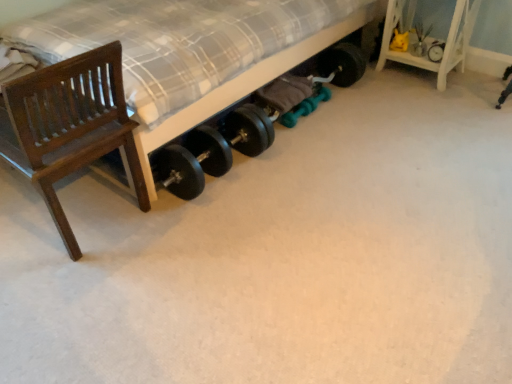
In order to click on dark wood chair at left in this screenshot , I will do `click(69, 126)`.

This screenshot has width=512, height=384. I want to click on white wood shelf at upper right, so click(446, 39).

Is black rubber tire at upper right positioned beyond the bounds of dark wood chair at left?

That's correct, black rubber tire at upper right is outside of dark wood chair at left.

From the image's perspective, who appears lower, black rubber tire at upper right or dark wood chair at left?

dark wood chair at left, from the image's perspective.

Is black rubber tire at upper right at the right side of dark wood chair at left?

Indeed, black rubber tire at upper right is positioned on the right side of dark wood chair at left.

Which object is thinner, black rubber tire at upper right or dark wood chair at left?

With smaller width is black rubber tire at upper right.

Which object is positioned more to the right, dark wood chair at left or white wood shelf at upper right?

Positioned to the right is white wood shelf at upper right.

In terms of width, does dark wood chair at left look wider or thinner when compared to white wood shelf at upper right?

Clearly, dark wood chair at left has more width compared to white wood shelf at upper right.

Are dark wood chair at left and white wood shelf at upper right making contact?

They are not placed beside each other.

Which object is positioned more to the left, matte black dumbbells at lower center or black rubber tire at upper right?

Positioned to the left is matte black dumbbells at lower center.

In the scene shown: Can you confirm if matte black dumbbells at lower center is taller than black rubber tire at upper right?

Correct, matte black dumbbells at lower center is much taller as black rubber tire at upper right.

Would you say matte black dumbbells at lower center is inside or outside black rubber tire at upper right?

matte black dumbbells at lower center exists outside the volume of black rubber tire at upper right.

From the image's perspective, which is above, matte black dumbbells at lower center or black rubber tire at upper right?

matte black dumbbells at lower center is shown above in the image.

Which of these two, matte black dumbbells at lower center or white wood shelf at upper right, is bigger?

matte black dumbbells at lower center is bigger.

From the picture: Is white wood shelf at upper right inside matte black dumbbells at lower center?

No, matte black dumbbells at lower center does not contain white wood shelf at upper right.

From a real-world perspective, is matte black dumbbells at lower center below white wood shelf at upper right?

Actually, matte black dumbbells at lower center is physically above white wood shelf at upper right in the real world.

Measure the distance between matte black dumbbells at lower center and white wood shelf at upper right.

matte black dumbbells at lower center is 1.09 meters away from white wood shelf at upper right.

From the image's perspective, is black rubber tire at upper right beneath white wood shelf at upper right?

Correct, black rubber tire at upper right appears lower than white wood shelf at upper right in the image.

What are the coordinates of `tire beneath the white wood shelf at upper right (from a real-world perspective)` in the screenshot? It's located at (436, 51).

Can you confirm if black rubber tire at upper right is smaller than white wood shelf at upper right?

Indeed, black rubber tire at upper right has a smaller size compared to white wood shelf at upper right.

Considering the relative positions of white wood shelf at upper right and dark wood chair at left in the image provided, is white wood shelf at upper right to the left of dark wood chair at left from the viewer's perspective?

No.

Does point (385, 36) lie behind point (64, 109)?

Yes, point (385, 36) is farther from viewer.

Could you tell me if white wood shelf at upper right is facing dark wood chair at left?

Yes, white wood shelf at upper right faces towards dark wood chair at left.

Which of these two, white wood shelf at upper right or dark wood chair at left, is wider?

Wider between the two is dark wood chair at left.

Locate an element on the screen. bed behind the dark wood chair at left is located at coordinates (194, 51).

Between dark wood chair at left and matte black dumbbells at lower center, which one has more height?

Standing taller between the two is matte black dumbbells at lower center.

Which object is wider, dark wood chair at left or matte black dumbbells at lower center?

matte black dumbbells at lower center.

Consider the image. Can you tell me how much dark wood chair at left and matte black dumbbells at lower center differ in facing direction?

There is a 0.57-degree angle between the facing directions of dark wood chair at left and matte black dumbbells at lower center.

At what (x,y) coordinates should I click in order to perform the action: click on chair on the left of black rubber tire at upper right. Please return your answer as a coordinate pair (x, y). Looking at the image, I should click on (69, 126).

The image size is (512, 384). Find the location of `furniture above the dark wood chair at left (from the image's perspective)`. furniture above the dark wood chair at left (from the image's perspective) is located at coordinates (446, 39).

When comparing their distances from matte black dumbbells at lower center, does white wood shelf at upper right or black rubber tire at upper right seem further?

The object further to matte black dumbbells at lower center is black rubber tire at upper right.

Based on their spatial positions, is black rubber tire at upper right or matte black dumbbells at lower center closer to dark wood chair at left?

The object closer to dark wood chair at left is matte black dumbbells at lower center.

Which object lies nearer to the anchor point black rubber tire at upper right, matte black dumbbells at lower center or white wood shelf at upper right?

Among the two, white wood shelf at upper right is located nearer to black rubber tire at upper right.

When comparing their distances from matte black dumbbells at lower center, does dark wood chair at left or black rubber tire at upper right seem closer?

dark wood chair at left lies closer to matte black dumbbells at lower center than the other object.

Which object lies further to the anchor point dark wood chair at left, matte black dumbbells at lower center or black rubber tire at upper right?

black rubber tire at upper right is further to dark wood chair at left.

Which object lies further to the anchor point matte black dumbbells at lower center, white wood shelf at upper right or dark wood chair at left?

white wood shelf at upper right is positioned further to the anchor matte black dumbbells at lower center.

Estimate the real-world distances between objects in this image. Which object is closer to white wood shelf at upper right, dark wood chair at left or matte black dumbbells at lower center?

The object closer to white wood shelf at upper right is matte black dumbbells at lower center.

Based on the photo, estimate the real-world distances between objects in this image. Which object is closer to dark wood chair at left, white wood shelf at upper right or matte black dumbbells at lower center?

matte black dumbbells at lower center is closer to dark wood chair at left.

The image size is (512, 384). In order to click on furniture between dark wood chair at left and black rubber tire at upper right in this screenshot , I will do `click(446, 39)`.

The image size is (512, 384). I want to click on bed between dark wood chair at left and white wood shelf at upper right from left to right, so click(x=194, y=51).

Find the location of `furniture situated between matte black dumbbells at lower center and black rubber tire at upper right from left to right`. furniture situated between matte black dumbbells at lower center and black rubber tire at upper right from left to right is located at coordinates (446, 39).

Locate an element on the screen. The image size is (512, 384). bed between dark wood chair at left and black rubber tire at upper right in the horizontal direction is located at coordinates tap(194, 51).